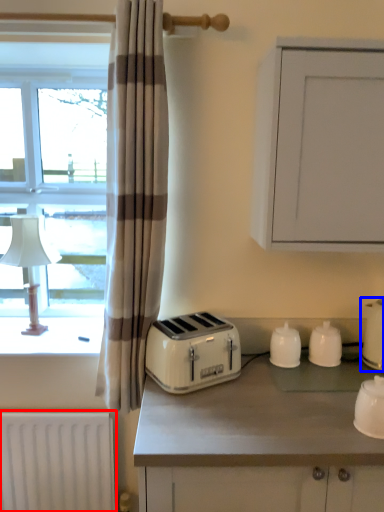
Question: Which of the following is the farthest to the observer, radiator (highlighted by a red box) or kitchen appliance (highlighted by a blue box)?

Choices:
 (A) radiator
 (B) kitchen appliance

Answer: (A)